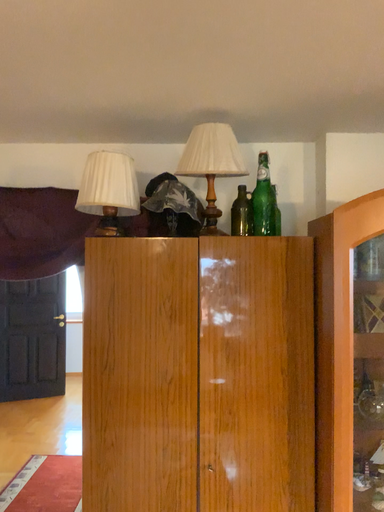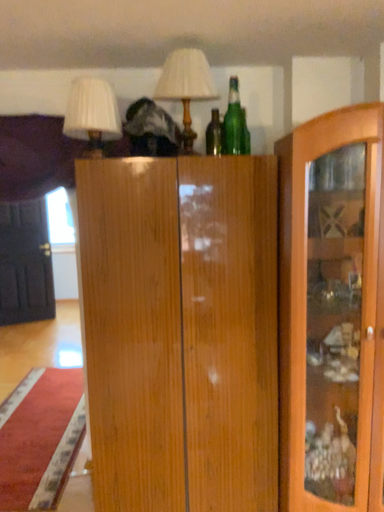
Question: Which way did the camera rotate in the video?

Choices:
 (A) rotated upward
 (B) rotated downward

Answer: (B)